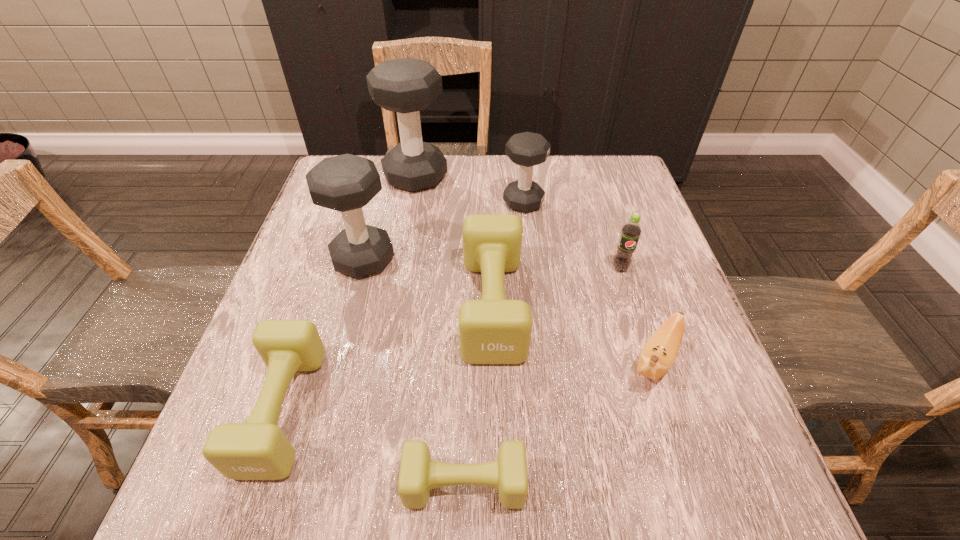
Locate an element on the screen. the tallest dumbbell is located at coordinates click(407, 86).

Find the location of a particular element. the biggest gray dumbbell is located at coordinates (407, 86).

Locate an element on the screen. the seventh shortest object is located at coordinates (346, 183).

Image resolution: width=960 pixels, height=540 pixels. In order to click on the nearest gray dumbbell in this screenshot , I will do `click(346, 183)`.

What are the coordinates of `the rightmost gray dumbbell` in the screenshot? It's located at (527, 149).

Identify the location of the smallest gray dumbbell. The height and width of the screenshot is (540, 960). tap(527, 149).

This screenshot has height=540, width=960. I want to click on the fifth shortest object, so click(631, 231).

Where is `green soda`? The image size is (960, 540). green soda is located at coordinates (631, 231).

Locate an element on the screen. This screenshot has width=960, height=540. the fourth shortest object is located at coordinates (493, 330).

The width and height of the screenshot is (960, 540). In order to click on the biggest olive dumbbell in this screenshot , I will do `click(493, 330)`.